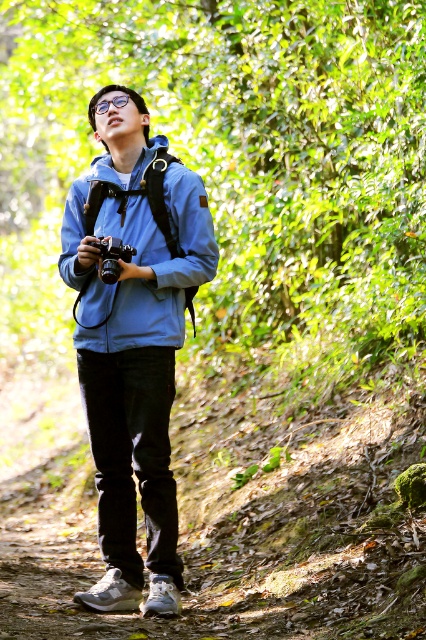
Is blue fabric jacket at center below matte black camera at center?

Yes.

From the picture: Who is lower down, blue fabric jacket at center or matte black camera at center?

blue fabric jacket at center is below.

Who is more forward, (158, 472) or (117, 262)?

Point (117, 262) is in front.

Where is `blue fabric jacket at center`? The image size is (426, 640). blue fabric jacket at center is located at coordinates (134, 339).

Who is taller, brown dirt path at center or matte black camera at center?

With more height is brown dirt path at center.

Measure the distance between brown dirt path at center and camera.

brown dirt path at center is 4.16 meters away from camera.

Who is more forward, (405, 531) or (100, 275)?

A: Point (405, 531)

At what (x,y) coordinates should I click in order to perform the action: click on brown dirt path at center. Please return your answer as a coordinate pair (x, y). Looking at the image, I should click on (244, 516).

Is point (146, 282) positioned before point (118, 241)?

That is False.

Does matte blue jacket at center have a greater height compared to matte black camera at center?

Yes, matte blue jacket at center is taller than matte black camera at center.

Does point (86, 289) lie in front of point (115, 237)?

That is False.

Where is `matte blue jacket at center`? The height and width of the screenshot is (640, 426). matte blue jacket at center is located at coordinates (140, 253).